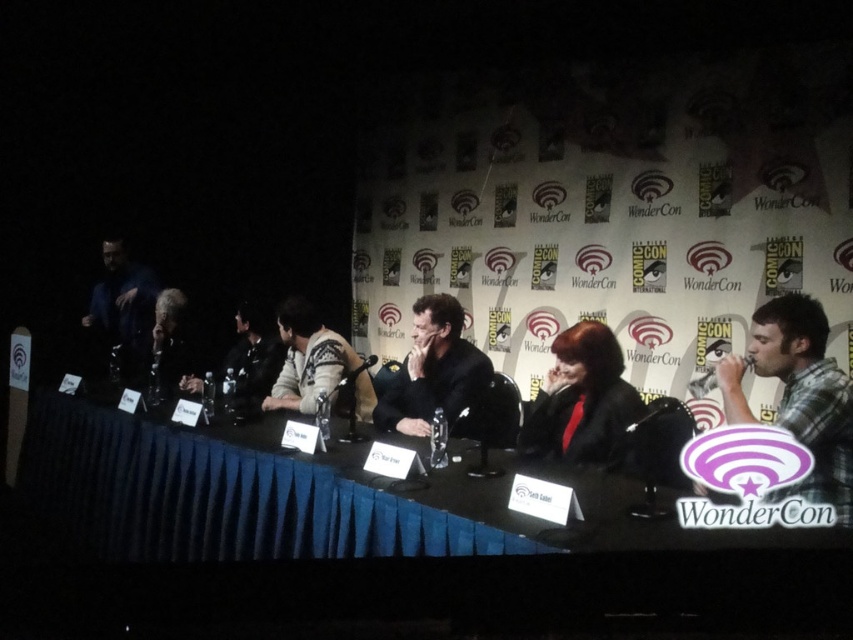
Describe the element at coordinates (433, 371) in the screenshot. I see `matte black jacket at center` at that location.

You are a GUI agent. You are given a task and a screenshot of the screen. Output one action in this format:
    pyautogui.click(x=<x>, y=<y>)
    Task: Click on the matte black jacket at center
    Image resolution: width=853 pixels, height=640 pixels.
    Given the screenshot: What is the action you would take?
    pyautogui.click(x=433, y=371)

Who is more forward, (433, 369) or (158, 296)?

Point (433, 369) is more forward.

The width and height of the screenshot is (853, 640). I want to click on matte black jacket at center, so click(433, 371).

Where is `blue fabric table at center`? The width and height of the screenshot is (853, 640). blue fabric table at center is located at coordinates (343, 548).

Who is shorter, blue fabric table at center or matte black jacket at center?

matte black jacket at center is shorter.

You are a GUI agent. You are given a task and a screenshot of the screen. Output one action in this format:
    pyautogui.click(x=<x>, y=<y>)
    Task: Click on the blue fabric table at center
    The width and height of the screenshot is (853, 640).
    Given the screenshot: What is the action you would take?
    pyautogui.click(x=343, y=548)

Find the location of a particular element. blue fabric table at center is located at coordinates (343, 548).

Is blue fabric table at center above plaid shirt at right?

Actually, blue fabric table at center is below plaid shirt at right.

Who is more distant from viewer, (314, 531) or (848, 384)?

The point (848, 384) is more distant.

Identify the location of blue fabric table at center. This screenshot has width=853, height=640. (343, 548).